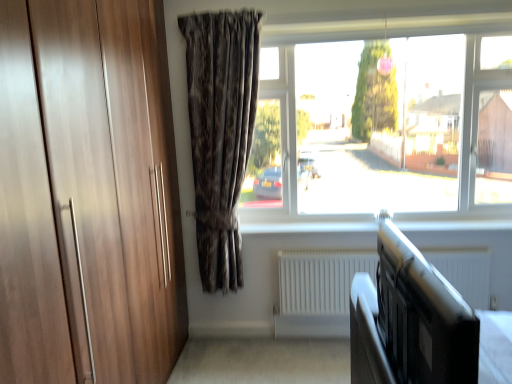
Find the location of `free location above black matte bed frame at lower right (from a real-world perspective)`. free location above black matte bed frame at lower right (from a real-world perspective) is located at coordinates (418, 266).